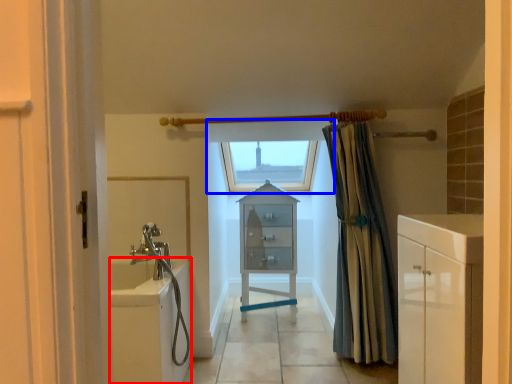
Question: Which object is further to the camera taking this photo, bath (highlighted by a red box) or window (highlighted by a blue box)?

Choices:
 (A) bath
 (B) window

Answer: (B)